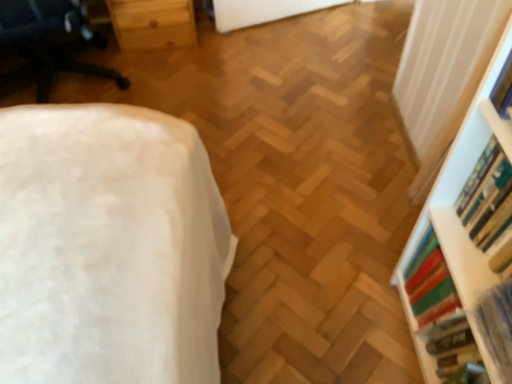
Question: Does hardcover book at right, marked as the 2th book in a bottom-to-top arrangement, have a greater width compared to hardcover book at upper right, arranged as the 1th book when viewed from the top?

Choices:
 (A) yes
 (B) no

Answer: (A)

Question: Is hardcover book at right, marked as the 2th book in a bottom-to-top arrangement, positioned before hardcover book at upper right, arranged as the 1th book when viewed from the top?

Choices:
 (A) yes
 (B) no

Answer: (B)

Question: From a real-world perspective, is hardcover book at right, the 3th book positioned from the top, on hardcover book at upper right, arranged as the 1th book when viewed from the top?

Choices:
 (A) yes
 (B) no

Answer: (B)

Question: Is hardcover book at right, the 3th book positioned from the top, touching hardcover book at upper right, which is the 4th book from bottom to top?

Choices:
 (A) no
 (B) yes

Answer: (A)

Question: Can you confirm if hardcover book at right, marked as the 2th book in a bottom-to-top arrangement, is shorter than hardcover book at upper right, which is the 4th book from bottom to top?

Choices:
 (A) no
 (B) yes

Answer: (A)

Question: In the image, is hardcover book at upper right, arranged as the 1th book when viewed from the top, on the left side or the right side of white plastic shelf at right?

Choices:
 (A) left
 (B) right

Answer: (A)

Question: Is hardcover book at upper right, arranged as the 1th book when viewed from the top, wider or thinner than white plastic shelf at right?

Choices:
 (A) thin
 (B) wide

Answer: (A)

Question: Is point (502, 69) closer or farther from the camera than point (471, 312)?

Choices:
 (A) farther
 (B) closer

Answer: (B)

Question: Considering the positions of hardcover book at upper right, arranged as the 1th book when viewed from the top, and white plastic shelf at right in the image, is hardcover book at upper right, arranged as the 1th book when viewed from the top, bigger or smaller than white plastic shelf at right?

Choices:
 (A) big
 (B) small

Answer: (B)

Question: Is white fabric ottoman at left taller or shorter than white plastic shelf at right?

Choices:
 (A) tall
 (B) short

Answer: (B)

Question: From the image's perspective, is white fabric ottoman at left above or below white plastic shelf at right?

Choices:
 (A) below
 (B) above

Answer: (B)

Question: From a real-world perspective, is white fabric ottoman at left above or below white plastic shelf at right?

Choices:
 (A) below
 (B) above

Answer: (A)

Question: Does point (0, 81) appear closer or farther from the camera than point (479, 221)?

Choices:
 (A) farther
 (B) closer

Answer: (A)

Question: From a real-world perspective, is hardcover book at right, the third book when ordered from bottom to top, above or below white plastic shelf at right?

Choices:
 (A) below
 (B) above

Answer: (B)

Question: In terms of size, does hardcover book at right, acting as the 2th book starting from the top, appear bigger or smaller than white plastic shelf at right?

Choices:
 (A) big
 (B) small

Answer: (B)